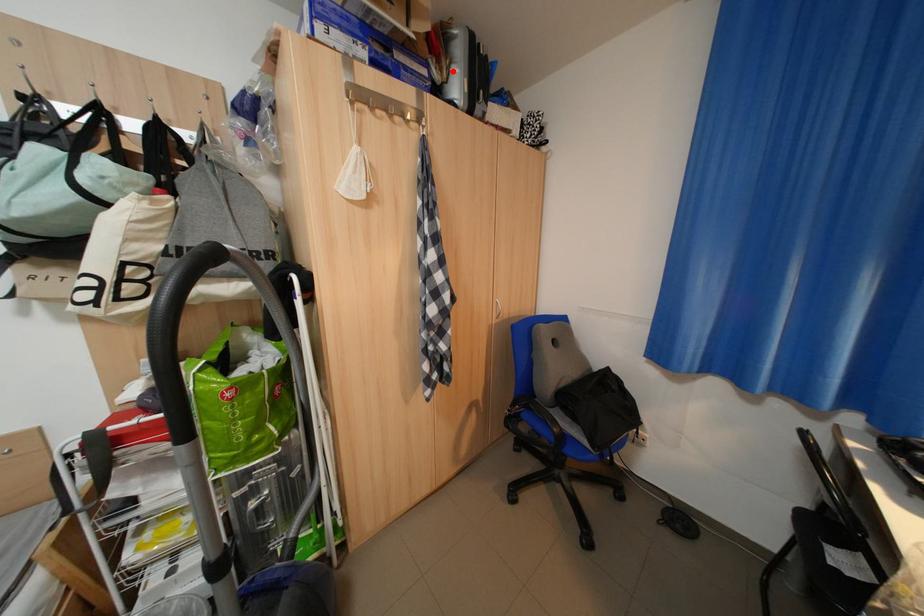
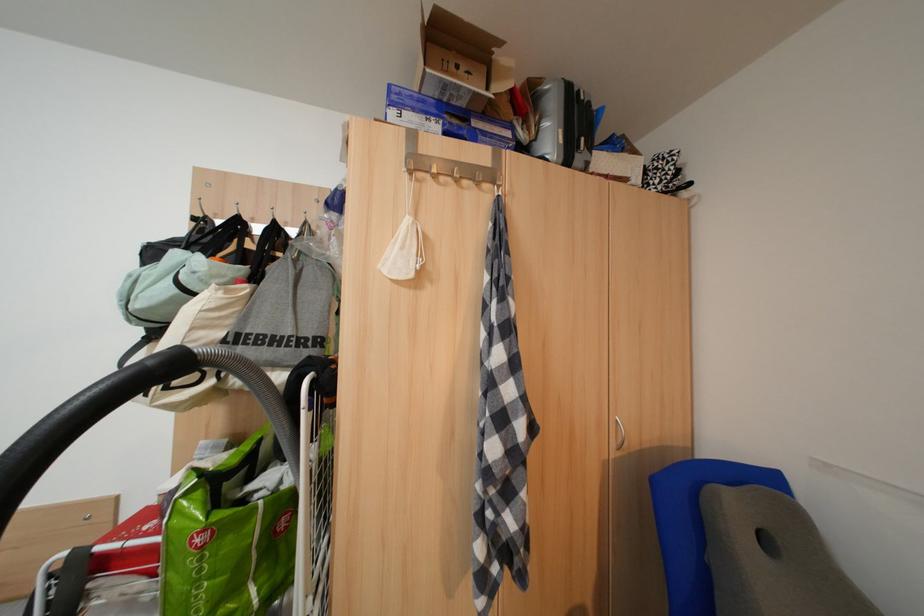
Locate, in the second image, the point that corresponds to the highlighted location in the first image.

(541, 130)